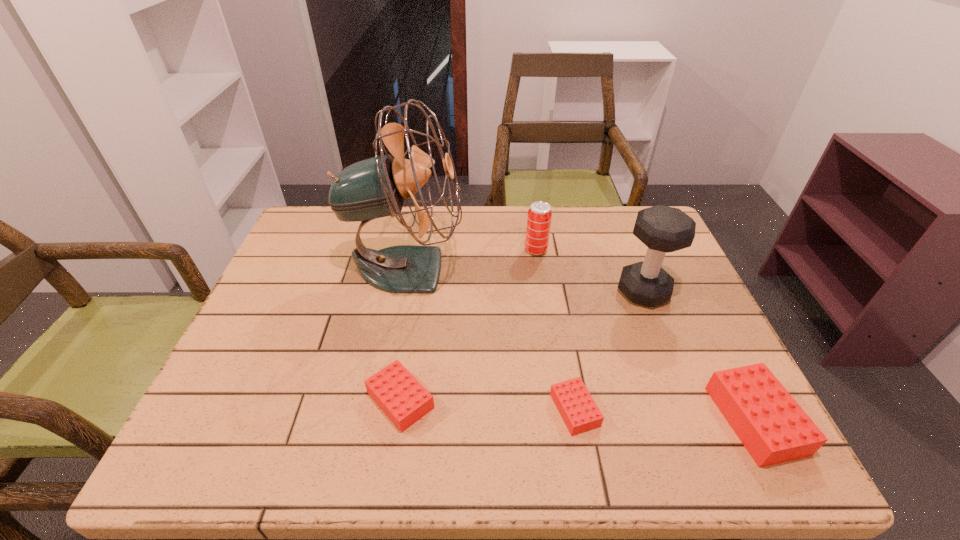
Locate an element on the screen. The width and height of the screenshot is (960, 540). free space located on the back of the second Lego from right to left is located at coordinates (564, 346).

This screenshot has height=540, width=960. Find the location of `free point located on the back of the fourth tallest object`. free point located on the back of the fourth tallest object is located at coordinates (677, 266).

Identify the location of vacant space located on the back of the fourth shortest object. (530, 208).

This screenshot has width=960, height=540. What are the coordinates of `vacant space located 0.380m on the front-facing side of the tallest object for air flow` in the screenshot? It's located at (600, 268).

Where is `vacant space located on the front of the second tallest object`? Image resolution: width=960 pixels, height=540 pixels. vacant space located on the front of the second tallest object is located at coordinates (658, 329).

This screenshot has height=540, width=960. Identify the location of soda can situated at the far edge. (539, 217).

Identify the location of fan at the far edge. (376, 187).

Locate an element on the screen. Lego located at the right edge is located at coordinates (771, 425).

Locate an element on the screen. dumbbell located in the right edge section of the desktop is located at coordinates pyautogui.click(x=663, y=229).

Locate an element on the screen. The height and width of the screenshot is (540, 960). object that is at the near right corner is located at coordinates (771, 425).